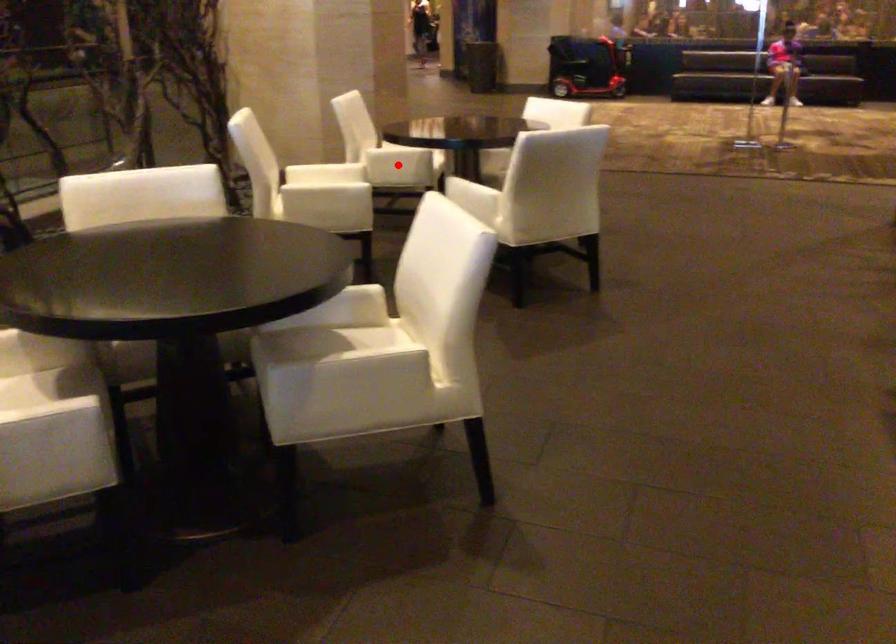
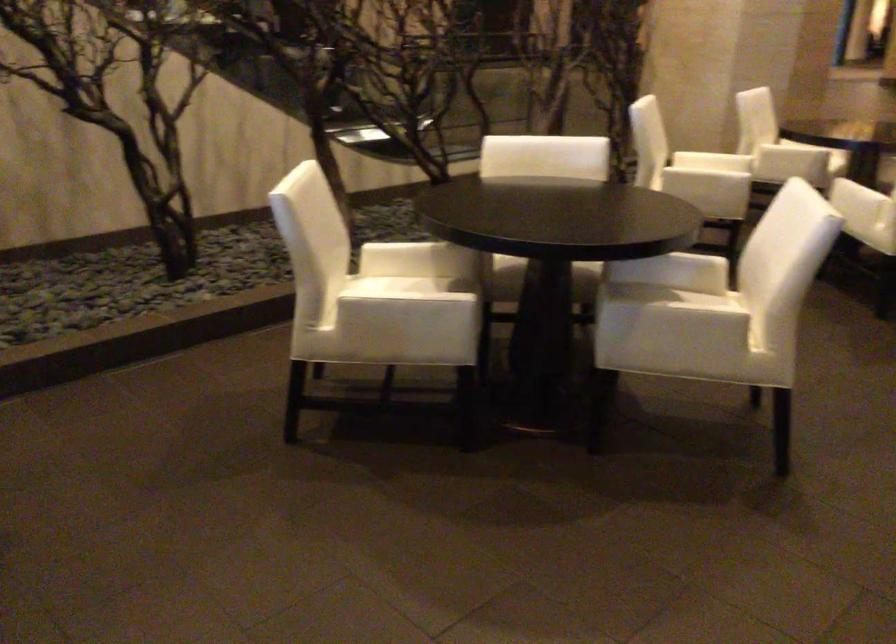
Question: I am providing you with two images of the same scene from different viewpoints. A red point is marked on the first image. Can you still see the location of the red point in image 2?

Choices:
 (A) Yes
 (B) No

Answer: (B)